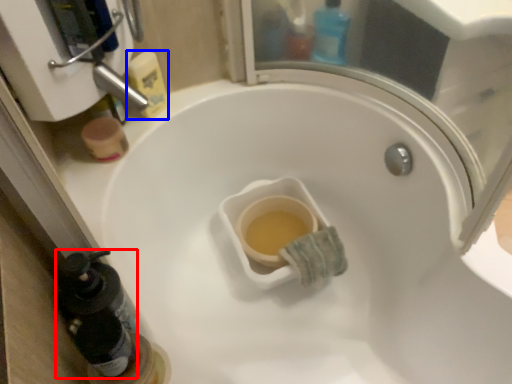
Question: Which of the following is the closest to the observer, bottle (highlighted by a red box) or cleaning product (highlighted by a blue box)?

Choices:
 (A) bottle
 (B) cleaning product

Answer: (A)